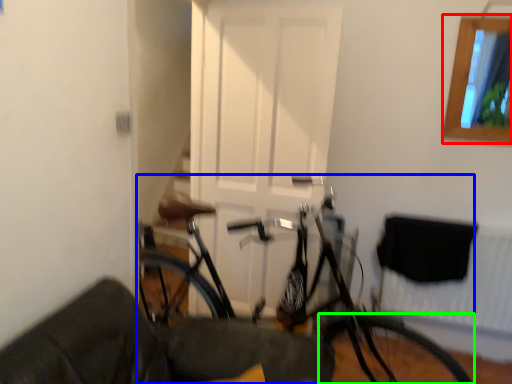
Question: Considering the real-world distances, which object is farthest from window (highlighted by a red box)? bicycle (highlighted by a blue box) or bicycle wheel (highlighted by a green box)?

Choices:
 (A) bicycle
 (B) bicycle wheel

Answer: (B)